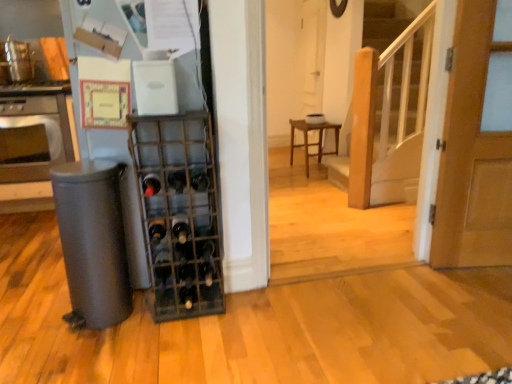
The image size is (512, 384). What do you see at coordinates (312, 54) in the screenshot?
I see `white matte screen door at center` at bounding box center [312, 54].

Based on the photo, measure the distance between black glass wine bottle at center, which ranks as the fifth wine bottle in bottom-to-top order, and camera.

6.14 feet.

At what (x,y) coordinates should I click in order to perform the action: click on light wood stairwell at upper right. Please return your answer as a coordinate pair (x, y). Image resolution: width=512 pixels, height=384 pixels. Looking at the image, I should click on (386, 119).

Which object is closer to the camera, white matte switch at upper center, which ranks as the second appliance in bottom-to-top order, or metallic wine rack at center?

metallic wine rack at center is in front.

Looking at this image, considering the sizes of objects white matte switch at upper center, which ranks as the second appliance in bottom-to-top order, and metallic wine rack at center in the image provided, who is bigger, white matte switch at upper center, which ranks as the second appliance in bottom-to-top order, or metallic wine rack at center?

metallic wine rack at center.

Image resolution: width=512 pixels, height=384 pixels. I want to click on the 1st appliance to the left when counting from the metallic wine rack at center, so click(x=155, y=87).

In the scene shown: Does white matte switch at upper center, which ranks as the second appliance in bottom-to-top order, touch metallic wine rack at center?

white matte switch at upper center, which ranks as the second appliance in bottom-to-top order, and metallic wine rack at center are clearly separated.

Which is more to the right, white matte switch at upper center, which ranks as the second appliance in bottom-to-top order, or translucent glass wine bottle at center, placed as the 2th wine bottle when sorted from bottom to top?

translucent glass wine bottle at center, placed as the 2th wine bottle when sorted from bottom to top, is more to the right.

Is point (144, 114) farther from camera compared to point (182, 237)?

That is False.

Considering the sizes of objects white matte switch at upper center, which ranks as the second appliance in bottom-to-top order, and translucent glass wine bottle at center, placed as the 2th wine bottle when sorted from bottom to top, in the image provided, who is bigger, white matte switch at upper center, which ranks as the second appliance in bottom-to-top order, or translucent glass wine bottle at center, placed as the 2th wine bottle when sorted from bottom to top,?

white matte switch at upper center, which ranks as the second appliance in bottom-to-top order, is bigger.

Choose the correct answer: Is white matte switch at upper center, the 1th appliance when ordered from top to bottom, inside translucent glass wine bottle at center, placed as the fourth wine bottle when sorted from top to bottom, or outside it?

white matte switch at upper center, the 1th appliance when ordered from top to bottom, is located beyond the bounds of translucent glass wine bottle at center, placed as the fourth wine bottle when sorted from top to bottom.

Is black glass wine bottle at center, the first wine bottle from the bottom, not near translucent glass wine bottle at center, placed as the 2th wine bottle when sorted from bottom to top?

No, black glass wine bottle at center, the first wine bottle from the bottom, is not far away from translucent glass wine bottle at center, placed as the 2th wine bottle when sorted from bottom to top.

Relative to translucent glass wine bottle at center, placed as the fourth wine bottle when sorted from top to bottom, is black glass wine bottle at center, the first wine bottle from the bottom, in front or behind?

In the image, black glass wine bottle at center, the first wine bottle from the bottom, appears in front of translucent glass wine bottle at center, placed as the fourth wine bottle when sorted from top to bottom.

Between point (158, 232) and point (178, 224), which one is positioned in front?

The point (158, 232) is more forward.

Can you confirm if black glass wine bottle at center, the first wine bottle from the bottom, is shorter than translucent glass wine bottle at center, placed as the 2th wine bottle when sorted from bottom to top?

Yes.

Between wooden stool at center and dark green glass wine bottle at center, the fourth wine bottle when ordered from bottom to top, which one has more height?

With more height is wooden stool at center.

Is there a large distance between wooden stool at center and dark green glass wine bottle at center, which is the 2th wine bottle from top to bottom?

wooden stool at center is positioned a significant distance from dark green glass wine bottle at center, which is the 2th wine bottle from top to bottom.

Is wooden stool at center wider than dark green glass wine bottle at center, the fourth wine bottle when ordered from bottom to top?

Yes.

Does wooden stool at center have a larger size compared to translucent glass wine bottle at center, placed as the 2th wine bottle when sorted from bottom to top?

Yes, wooden stool at center is bigger than translucent glass wine bottle at center, placed as the 2th wine bottle when sorted from bottom to top.

Is translucent glass wine bottle at center, placed as the 2th wine bottle when sorted from bottom to top, completely or partially inside wooden stool at center?

No, wooden stool at center does not contain translucent glass wine bottle at center, placed as the 2th wine bottle when sorted from bottom to top.

Could you tell me if wooden stool at center is facing translucent glass wine bottle at center, placed as the 2th wine bottle when sorted from bottom to top?

No, wooden stool at center is not facing towards translucent glass wine bottle at center, placed as the 2th wine bottle when sorted from bottom to top.

From a real-world perspective, which object stands above the other?

In real-world perspective, translucent glass wine bottle at center, placed as the fourth wine bottle when sorted from top to bottom, is above.

Based on the photo, would you say satin silver oven at left is a long distance from dark green glass wine bottle at center, the fourth wine bottle when ordered from bottom to top?

That's right, there is a large distance between satin silver oven at left and dark green glass wine bottle at center, the fourth wine bottle when ordered from bottom to top.

Between satin silver oven at left and dark green glass wine bottle at center, which is the 2th wine bottle from top to bottom, which one appears on the left side from the viewer's perspective?

Positioned to the left is satin silver oven at left.

Between satin silver oven at left and dark green glass wine bottle at center, the fourth wine bottle when ordered from bottom to top, which one has smaller size?

dark green glass wine bottle at center, the fourth wine bottle when ordered from bottom to top, is smaller.

Can you confirm if satin silver oven at left is shorter than dark green glass wine bottle at center, which is the 2th wine bottle from top to bottom?

No.

From a real-world perspective, is metallic wine rack at center physically located above or below black glass wine bottle at center, acting as the 3th wine bottle starting from the top?

Clearly, from a real-world perspective, metallic wine rack at center is below black glass wine bottle at center, acting as the 3th wine bottle starting from the top.

Which object is closer to the camera taking this photo, metallic wine rack at center or black glass wine bottle at center, acting as the 3th wine bottle starting from the top?

metallic wine rack at center is closer to the camera.

From the image's perspective, who appears lower, metallic wine rack at center or black glass wine bottle at center, acting as the 3th wine bottle starting from the top?

From the image's view, metallic wine rack at center is below.

Looking at this image, are metallic wine rack at center and black glass wine bottle at center, acting as the 3th wine bottle starting from the top, located far from each other?

No, metallic wine rack at center is in close proximity to black glass wine bottle at center, acting as the 3th wine bottle starting from the top.

The image size is (512, 384). Identify the location of shelf in front of the white matte switch at upper center, which ranks as the second appliance in bottom-to-top order. (180, 214).

Starting from the translucent glass wine bottle at center, placed as the 2th wine bottle when sorted from bottom to top, which appliance is the 1st one to the left? Please provide its 2D coordinates.

[(155, 87)]

When comparing their distances from black glass wine bottle at center, which ranks as the fifth wine bottle in bottom-to-top order, does metallic wine rack at center or white matte switch at upper center, which ranks as the second appliance in bottom-to-top order, seem closer?

metallic wine rack at center is positioned closer to the anchor black glass wine bottle at center, which ranks as the fifth wine bottle in bottom-to-top order.

When comparing their distances from white matte screen door at center, does satin silver oven at left or black glass wine bottle at center, the first wine bottle from the bottom, seem further?

black glass wine bottle at center, the first wine bottle from the bottom, is further to white matte screen door at center.

Looking at the image, which one is located closer to dark green glass wine bottle at center, the fourth wine bottle when ordered from bottom to top, satin silver oven at left or white matte screen door at center?

satin silver oven at left is closer to dark green glass wine bottle at center, the fourth wine bottle when ordered from bottom to top.

Looking at the image, which one is located further to satin silver oven at left, matte gray trash can at left, the first appliance ordered from the bottom, or metallic wine rack at center?

metallic wine rack at center is positioned further to the anchor satin silver oven at left.

Which object lies nearer to the anchor point dark green glass wine bottle at center, which is the 2th wine bottle from top to bottom, light wood stairwell at upper right or black glass wine bottle at center, the first wine bottle from the bottom?

black glass wine bottle at center, the first wine bottle from the bottom, lies closer to dark green glass wine bottle at center, which is the 2th wine bottle from top to bottom, than the other object.

Which object lies nearer to the anchor point matte gray trash can at left, which ranks as the 2th appliance in top-to-bottom order, black glass wine bottle at center, which ranks as the fifth wine bottle in bottom-to-top order, or black glass wine bottle at center, the fifth wine bottle from the top?

black glass wine bottle at center, which ranks as the fifth wine bottle in bottom-to-top order.

When comparing their distances from satin silver oven at left, does black glass wine bottle at center, which appears as the first wine bottle when viewed from the top, or white matte switch at upper center, which ranks as the second appliance in bottom-to-top order, seem further?

white matte switch at upper center, which ranks as the second appliance in bottom-to-top order.

Considering their positions, is black glass wine bottle at center, the 3th wine bottle ordered from the bottom, positioned closer to wooden stool at center than satin silver oven at left?

satin silver oven at left is positioned closer to the anchor wooden stool at center.

This screenshot has width=512, height=384. In order to click on appliance between satin silver oven at left and black glass wine bottle at center, the first wine bottle from the bottom in this screenshot , I will do `click(173, 190)`.

The height and width of the screenshot is (384, 512). Find the location of `stairwell located between black glass wine bottle at center, which ranks as the fifth wine bottle in bottom-to-top order, and wooden stool at center in the depth direction`. stairwell located between black glass wine bottle at center, which ranks as the fifth wine bottle in bottom-to-top order, and wooden stool at center in the depth direction is located at coordinates (386, 119).

Where is `oven located between matte gray trash can at left, which ranks as the 2th appliance in top-to-bottom order, and white matte screen door at center in the depth direction`? oven located between matte gray trash can at left, which ranks as the 2th appliance in top-to-bottom order, and white matte screen door at center in the depth direction is located at coordinates (34, 138).

Find the location of a particular element. The height and width of the screenshot is (384, 512). appliance between white matte switch at upper center, the 1th appliance when ordered from top to bottom, and black glass wine bottle at center, the fifth wine bottle from the top, in the up-down direction is located at coordinates (173, 190).